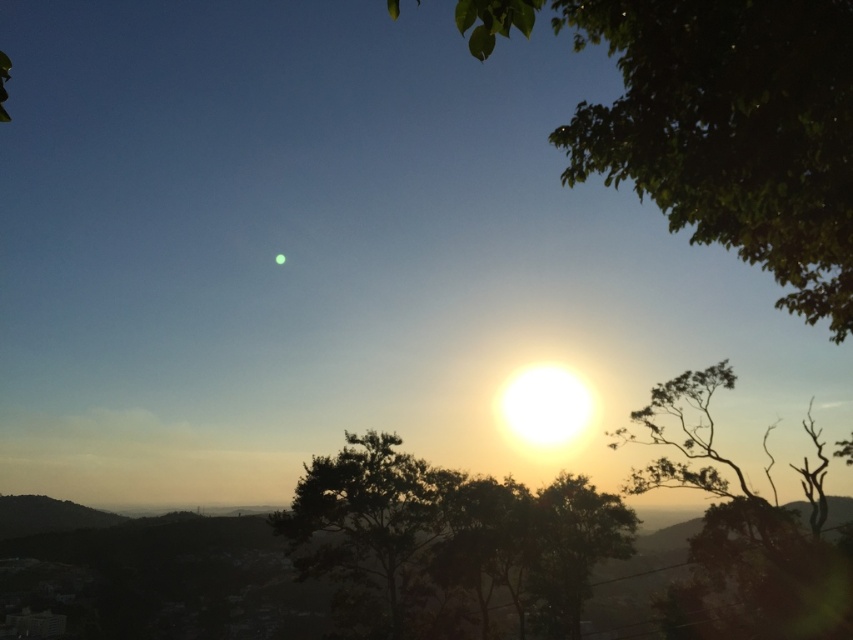
Question: Is the position of green leafy tree at upper right more distant than that of silhouette/textured tree at center?

Choices:
 (A) no
 (B) yes

Answer: (A)

Question: Does green leafy tree at upper right appear on the right side of silhouette/textured tree at center?

Choices:
 (A) yes
 (B) no

Answer: (A)

Question: Can you confirm if green leafy tree at upper right is wider than silhouette/textured tree at center?

Choices:
 (A) no
 (B) yes

Answer: (B)

Question: Which object is closer to the camera taking this photo?

Choices:
 (A) silhouette/textured tree at center
 (B) green leafy tree at upper right

Answer: (B)